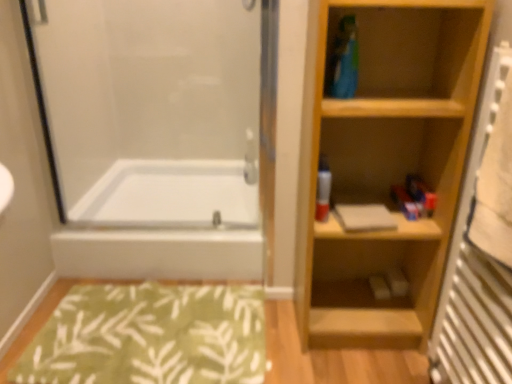
Question: Is matte gray book at center looking in the opposite direction of white glossy bathtub at lower left?

Choices:
 (A) yes
 (B) no

Answer: (B)

Question: Is matte gray book at center far from white glossy bathtub at lower left?

Choices:
 (A) yes
 (B) no

Answer: (B)

Question: Does matte gray book at center have a lesser height compared to white glossy bathtub at lower left?

Choices:
 (A) no
 (B) yes

Answer: (B)

Question: From a real-world perspective, is matte gray book at center on top of white glossy bathtub at lower left?

Choices:
 (A) no
 (B) yes

Answer: (B)

Question: Is matte gray book at center located outside white glossy bathtub at lower left?

Choices:
 (A) no
 (B) yes

Answer: (B)

Question: Considering the relative positions of matte gray book at center and white glossy bathtub at lower left in the image provided, is matte gray book at center to the left of white glossy bathtub at lower left from the viewer's perspective?

Choices:
 (A) yes
 (B) no

Answer: (B)

Question: From the image's perspective, is light wood bookshelf at right located above transparent glass screen door at left?

Choices:
 (A) yes
 (B) no

Answer: (B)

Question: Does light wood bookshelf at right have a smaller size compared to transparent glass screen door at left?

Choices:
 (A) no
 (B) yes

Answer: (A)

Question: Does light wood bookshelf at right turn towards transparent glass screen door at left?

Choices:
 (A) yes
 (B) no

Answer: (B)

Question: Is light wood bookshelf at right further to camera compared to transparent glass screen door at left?

Choices:
 (A) no
 (B) yes

Answer: (A)

Question: Would you say light wood bookshelf at right is outside transparent glass screen door at left?

Choices:
 (A) no
 (B) yes

Answer: (B)

Question: Is light wood bookshelf at right at the right side of transparent glass screen door at left?

Choices:
 (A) no
 (B) yes

Answer: (B)

Question: From the image's perspective, is light wood bookshelf at right located beneath wooden radiator at right?

Choices:
 (A) yes
 (B) no

Answer: (B)